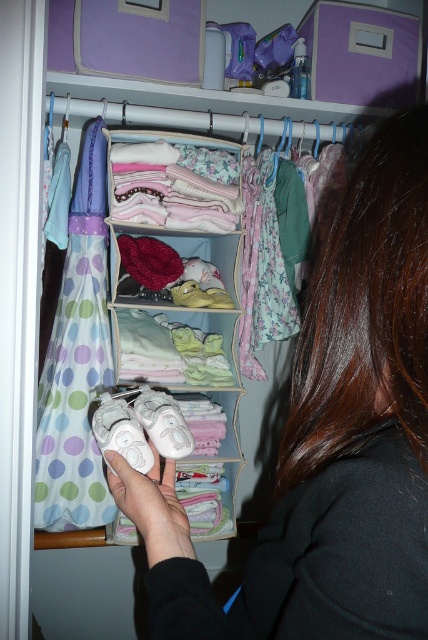
Does polka dot fabric dress at left appear on the right side of white suede shoe at center?

Incorrect, polka dot fabric dress at left is not on the right side of white suede shoe at center.

Between point (58, 305) and point (140, 408), which one is positioned behind?

Point (58, 305)

This screenshot has height=640, width=428. I want to click on polka dot fabric dress at left, so click(77, 362).

Is point (416, 620) farther from viewer compared to point (104, 397)?

No.

Is point (407, 593) farther from camera compared to point (125, 392)?

No, (407, 593) is in front of (125, 392).

Find the location of a particular element. Image resolution: width=428 pixels, height=640 pixels. white soft baby shoes at center is located at coordinates (320, 557).

Who is shorter, white fabric baby shoes at center or white suede baby shoes at center?

With less height is white suede baby shoes at center.

Between white fabric baby shoes at center and white suede baby shoes at center, which one has more height?

white fabric baby shoes at center

Who is more forward, [118,250] or [109,438]?

Point [109,438] is more forward.

The image size is (428, 640). I want to click on white fabric baby shoes at center, so click(157, 326).